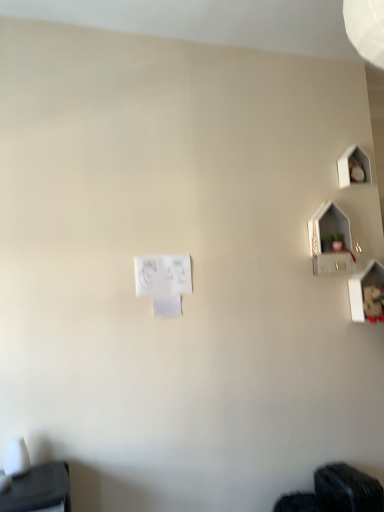
What is the approximate width of white paper at center?

It is 0.58 inches.

Locate an element on the screen. Image resolution: width=384 pixels, height=512 pixels. black fabric at lower right is located at coordinates (336, 492).

Image resolution: width=384 pixels, height=512 pixels. Find the location of `matte gray shelf at upper right`. matte gray shelf at upper right is located at coordinates (331, 241).

Based on the photo, from the image's perspective, which object appears higher, white paper at center or matte gray shelf at upper right?

matte gray shelf at upper right, from the image's perspective.

How far apart are white paper at center and matte gray shelf at upper right?

33.80 inches.

Is white paper at center positioned with its back to matte gray shelf at upper right?

No, white paper at center's orientation is not away from matte gray shelf at upper right.

Can you confirm if white paper at center is wider than matte gray shelf at upper right?

In fact, white paper at center might be narrower than matte gray shelf at upper right.

Is black fabric at lower right aimed at matte gray shelf at upper right?

No, black fabric at lower right does not turn towards matte gray shelf at upper right.

Is black fabric at lower right bigger than matte gray shelf at upper right?

Indeed, black fabric at lower right has a larger size compared to matte gray shelf at upper right.

Would you consider black fabric at lower right to be distant from matte gray shelf at upper right?

That's right, there is a large distance between black fabric at lower right and matte gray shelf at upper right.

How different are the orientations of matte gray shelf at upper right and black fabric at lower right in degrees?

There is a 2.61-degree angle between the facing directions of matte gray shelf at upper right and black fabric at lower right.

Is matte gray shelf at upper right far away from black fabric at lower right?

matte gray shelf at upper right is positioned a significant distance from black fabric at lower right.

Could you tell me if matte gray shelf at upper right is turned towards black fabric at lower right?

No.

Which point is more distant from viewer, (350, 255) or (315, 475)?

The point (350, 255) is farther.

Would you say white paper at center is to the left or to the right of black fabric at lower right in the picture?

Clearly, white paper at center is on the left of black fabric at lower right in the image.

Is white paper at center in contact with black fabric at lower right?

No, white paper at center is not touching black fabric at lower right.

From a real-world perspective, is white paper at center positioned above or below black fabric at lower right?

white paper at center is above black fabric at lower right.

Is white paper at center looking in the opposite direction of black fabric at lower right?

No, white paper at center's orientation is not away from black fabric at lower right.

Based on the photo, do you think black fabric at lower right is within white paper at center, or outside of it?

black fabric at lower right cannot be found inside white paper at center.

Is point (333, 487) less distant than point (187, 283)?

That is True.

Between black fabric at lower right and white paper at center, which one has larger size?

With larger size is black fabric at lower right.

What's the angular difference between matte gray shelf at upper right and white paper at center's facing directions?

The facing directions of matte gray shelf at upper right and white paper at center are 0.217 degrees apart.

Can you confirm if matte gray shelf at upper right is positioned to the left of white paper at center?

No.

Does point (327, 223) come behind point (137, 280)?

Yes.

Relative to white paper at center, is matte gray shelf at upper right in front or behind?

Clearly, matte gray shelf at upper right is behind white paper at center.

Find the location of a particular element. writing below the matte gray shelf at upper right (from the image's perspective) is located at coordinates (163, 274).

Identify the location of twin above the black fabric at lower right (from a real-world perspective). (331, 241).

Based on their spatial positions, is matte gray shelf at upper right or white paper at center further from black fabric at lower right?

white paper at center is positioned further to the anchor black fabric at lower right.

Considering their positions, is black fabric at lower right positioned closer to matte gray shelf at upper right than white paper at center?

white paper at center lies closer to matte gray shelf at upper right than the other object.

Based on their spatial positions, is matte gray shelf at upper right or black fabric at lower right further from white paper at center?

black fabric at lower right is positioned further to the anchor white paper at center.

In the scene shown: Considering their positions, is black fabric at lower right positioned further to white paper at center than matte gray shelf at upper right?

black fabric at lower right lies further to white paper at center than the other object.

Which object lies further to the anchor point matte gray shelf at upper right, white paper at center or black fabric at lower right?

The object further to matte gray shelf at upper right is black fabric at lower right.

When comparing their distances from black fabric at lower right, does white paper at center or matte gray shelf at upper right seem closer?

Among the two, matte gray shelf at upper right is located nearer to black fabric at lower right.

Find the location of a particular element. This screenshot has height=512, width=384. writing between matte gray shelf at upper right and black fabric at lower right vertically is located at coordinates (163, 274).